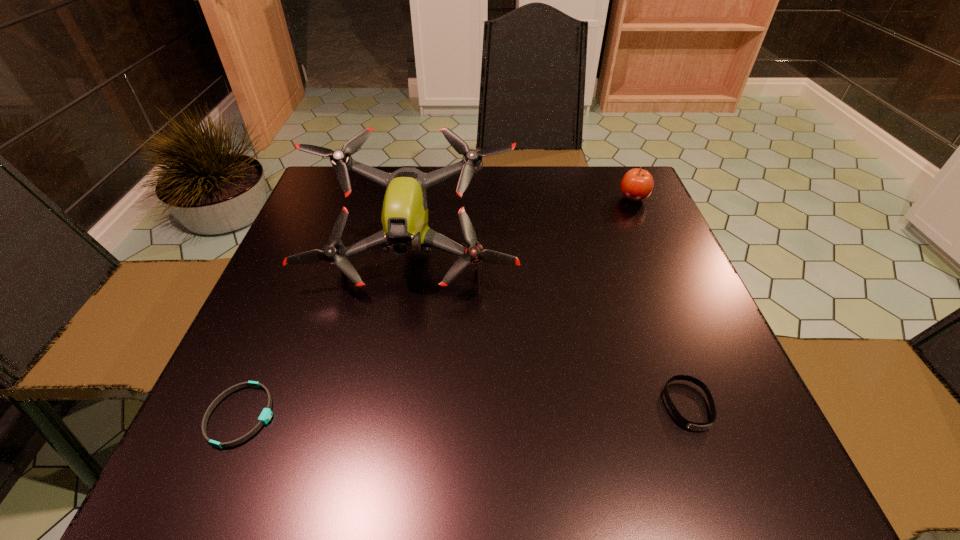
Where is `free spot at the near edge of the desktop`? Image resolution: width=960 pixels, height=540 pixels. free spot at the near edge of the desktop is located at coordinates (572, 483).

In the image, there is a desktop. Find the location of `vacant space at the left edge`. vacant space at the left edge is located at coordinates (225, 390).

In the image, there is a desktop. Identify the location of vacant area at the right edge. The width and height of the screenshot is (960, 540). tap(663, 403).

Locate an element on the screen. The image size is (960, 540). vacant area at the far left corner of the desktop is located at coordinates (319, 213).

You are a GUI agent. You are given a task and a screenshot of the screen. Output one action in this format:
    pyautogui.click(x=<x>, y=<y>)
    Task: Click on the free point at the near left corner
    
    Given the screenshot: What is the action you would take?
    pyautogui.click(x=193, y=480)

In the image, there is a desktop. Where is `vacant space at the far right corner`? This screenshot has width=960, height=540. vacant space at the far right corner is located at coordinates (638, 202).

At what (x,y) coordinates should I click in order to perform the action: click on free space between the right wristband and the tallest object. Please return your answer as a coordinate pair (x, y). Looking at the image, I should click on tap(550, 332).

Find the location of `vacant area that lies between the left wristband and the farthest object`. vacant area that lies between the left wristband and the farthest object is located at coordinates (438, 307).

I want to click on vacant space in between the right wristband and the shorter wristband, so click(x=465, y=410).

Image resolution: width=960 pixels, height=540 pixels. In order to click on vacant region between the third tallest object and the farthest object in this screenshot , I will do (660, 302).